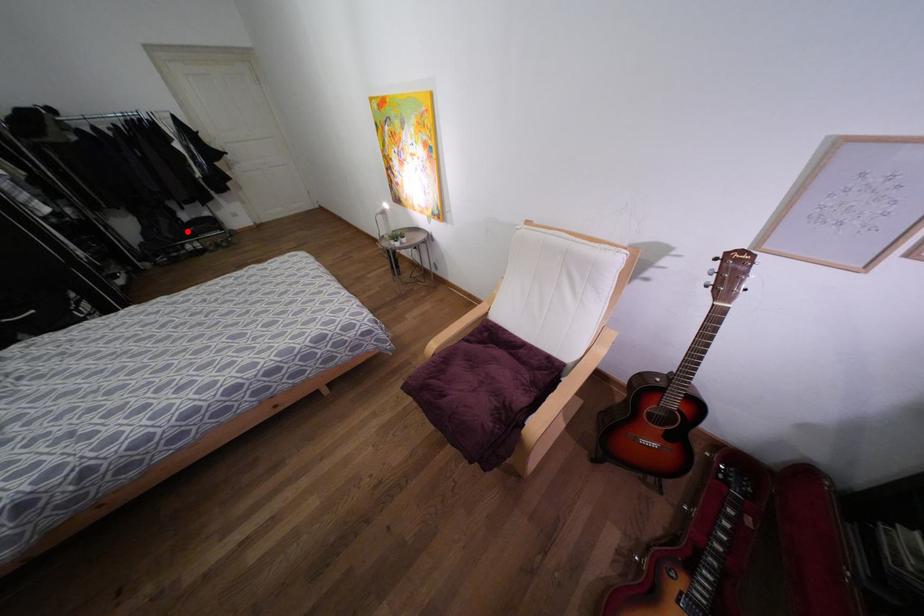
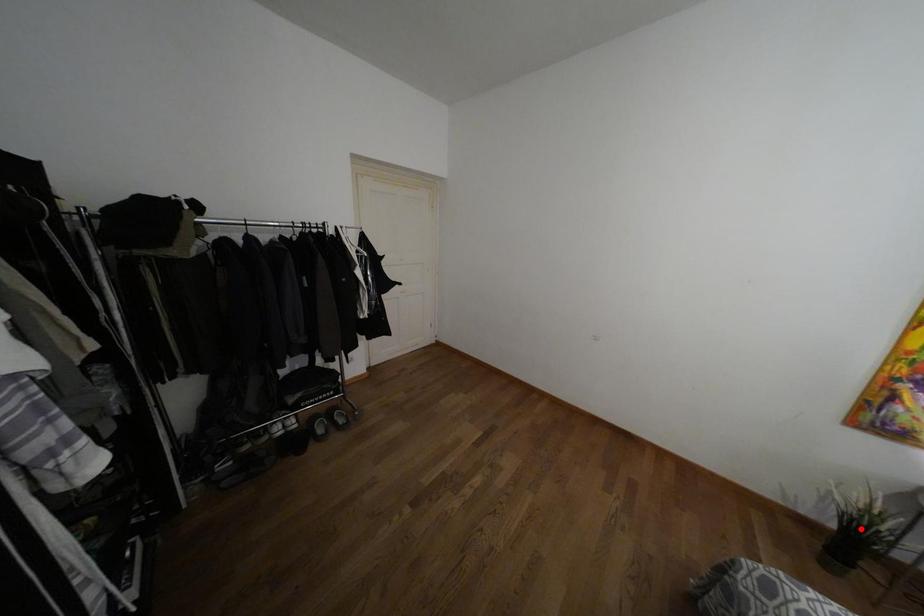
I am providing you with two images of the same scene from different viewpoints. A red point is marked on the first image and another point is marked on the second image. Are the points marked in image1 and image2 representing the same 3D position?

No